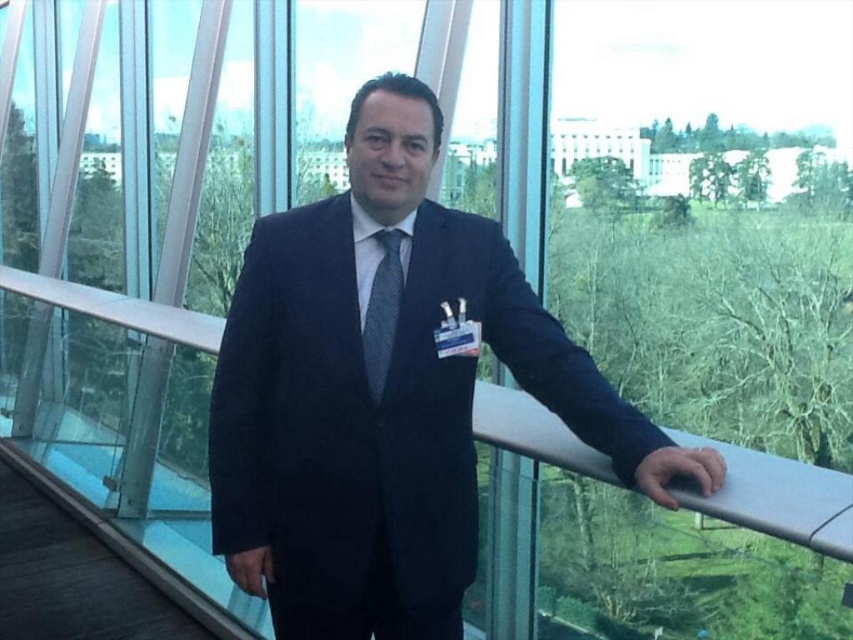
Question: Among these objects, which one is nearest to the camera?

Choices:
 (A) matte gray tie at center
 (B) navy blue suit at center

Answer: (B)

Question: Is navy blue suit at center positioned before matte gray tie at center?

Choices:
 (A) no
 (B) yes

Answer: (B)

Question: Which object appears farthest from the camera in this image?

Choices:
 (A) matte gray tie at center
 (B) navy blue suit at center

Answer: (A)

Question: Does navy blue suit at center appear over matte gray tie at center?

Choices:
 (A) no
 (B) yes

Answer: (A)

Question: Is the position of navy blue suit at center more distant than that of matte gray tie at center?

Choices:
 (A) yes
 (B) no

Answer: (B)